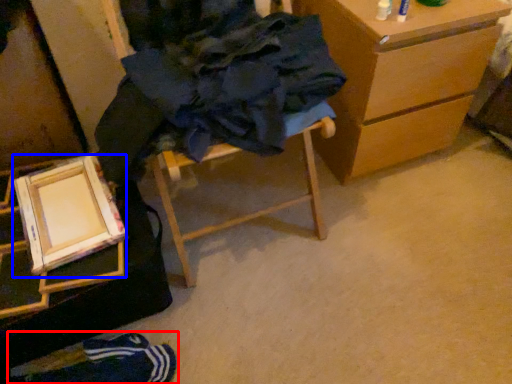
Question: Which of the following is the farthest to the observer, person (highlighted by a red box) or picture frame (highlighted by a blue box)?

Choices:
 (A) person
 (B) picture frame

Answer: (A)